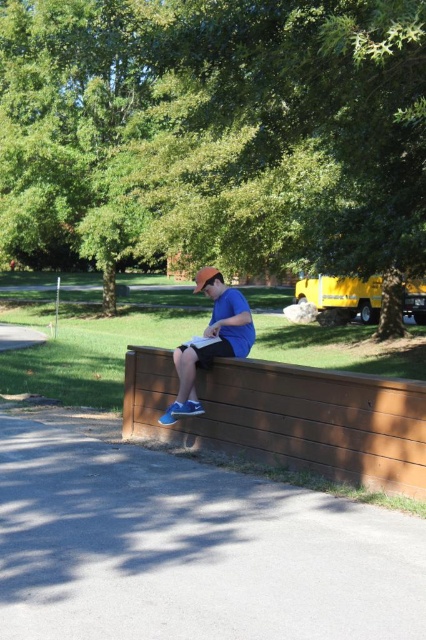
Question: Which point is closer to the camera taking this photo?

Choices:
 (A) (209, 356)
 (B) (304, 426)
 (C) (65, 252)

Answer: (B)

Question: Can you confirm if brown wooden bench at center is wider than matte blue shorts at center?

Choices:
 (A) no
 (B) yes

Answer: (B)

Question: Does green leafy tree at upper center appear under matte blue shorts at center?

Choices:
 (A) no
 (B) yes

Answer: (A)

Question: Is brown wooden bench at center below matte blue shorts at center?

Choices:
 (A) no
 (B) yes

Answer: (B)

Question: Estimate the real-world distances between objects in this image. Which object is closer to the brown wooden bench at center?

Choices:
 (A) green leafy tree at upper center
 (B) matte blue shorts at center

Answer: (B)

Question: Which of the following is the farthest from the observer?

Choices:
 (A) (333, 177)
 (B) (219, 332)
 (C) (322, 468)

Answer: (A)